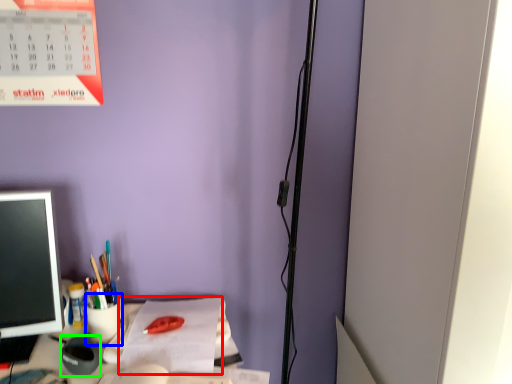
Question: Considering the real-world distances, which object is farthest from notebook (highlighted by a red box)? stationery (highlighted by a blue box) or stationery (highlighted by a green box)?

Choices:
 (A) stationery
 (B) stationery

Answer: (B)